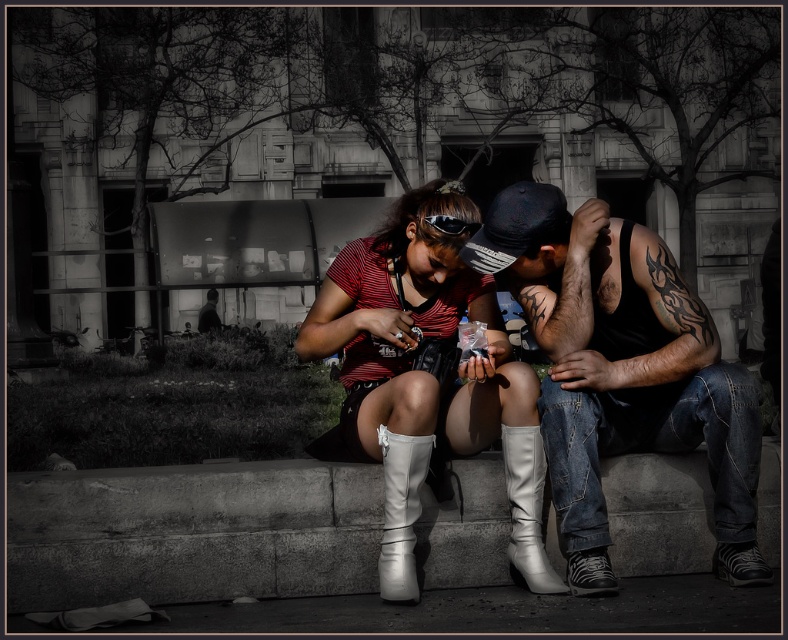
Which is in front, point (445, 296) or point (415, 492)?

Positioned in front is point (415, 492).

Does point (437, 356) lie behind point (403, 502)?

Yes, point (437, 356) is farther from viewer.

Find the location of a particular element. white leather boots at center is located at coordinates (426, 378).

Can you confirm if dark denim jeans at center is positioned to the right of black matte goggles at center?

Indeed, dark denim jeans at center is positioned on the right side of black matte goggles at center.

Is dark denim jeans at center positioned behind black matte goggles at center?

No, dark denim jeans at center is closer to the viewer.

Which is behind, point (549, 200) or point (437, 214)?

The point (549, 200) is more distant.

Find the location of a particular element. dark denim jeans at center is located at coordinates (623, 371).

Is dark denim jeans at center wider than white leather boot at lower center?

Yes, dark denim jeans at center is wider than white leather boot at lower center.

Can you confirm if dark denim jeans at center is positioned to the right of white leather boot at lower center?

A: Correct, you'll find dark denim jeans at center to the right of white leather boot at lower center.

Is point (556, 445) less distant than point (541, 492)?

That is True.

Where is `dark denim jeans at center`? dark denim jeans at center is located at coordinates (623, 371).